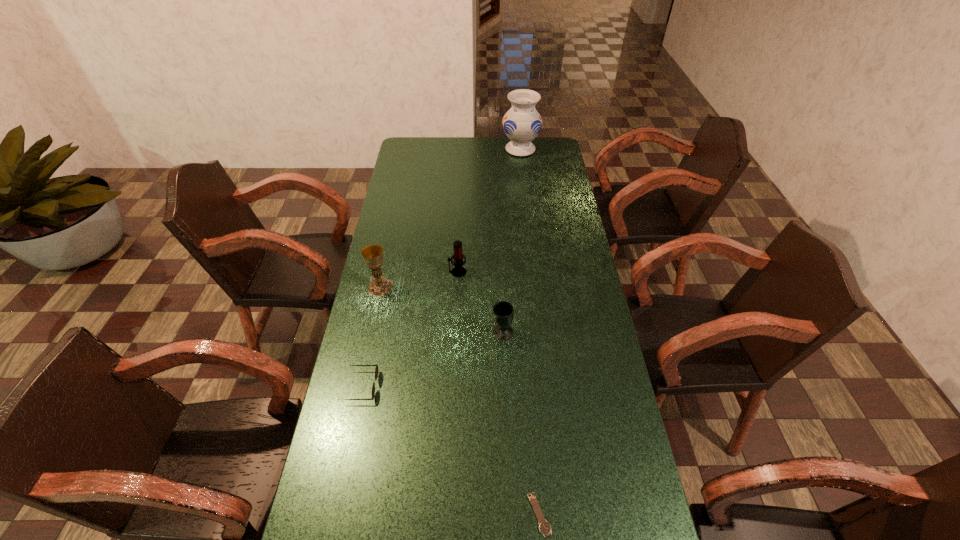
Identify the location of watch. (544, 527).

This screenshot has height=540, width=960. Identify the location of the nearest object. (544, 527).

The height and width of the screenshot is (540, 960). Find the location of `free space located 0.300m on the left of the vase`. free space located 0.300m on the left of the vase is located at coordinates (443, 150).

Locate an element on the screen. free region located on the back of the taller chalice is located at coordinates (389, 245).

Where is `free region located 0.150m on the front of the second farthest object`? This screenshot has height=540, width=960. free region located 0.150m on the front of the second farthest object is located at coordinates (456, 308).

Locate an element on the screen. Image resolution: width=960 pixels, height=540 pixels. blank space located on the front of the third nearest object is located at coordinates (503, 354).

This screenshot has height=540, width=960. Identify the location of free space located 0.100m on the front-facing side of the fifth farthest object. (410, 386).

Identify the location of blank space located on the right of the nearest object. (575, 515).

You are a GUI agent. You are given a task and a screenshot of the screen. Output one action in this format:
    pyautogui.click(x=<x>, y=<y>)
    Task: Click on the object positioned at the far edge
    The height and width of the screenshot is (540, 960).
    Given the screenshot: What is the action you would take?
    pyautogui.click(x=522, y=123)

Where is `chalice positioned at the left edge`? The height and width of the screenshot is (540, 960). chalice positioned at the left edge is located at coordinates (379, 286).